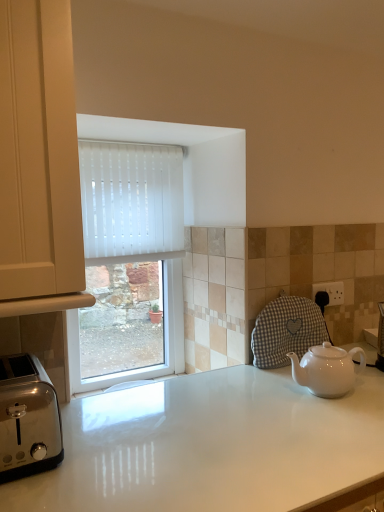
Question: Can you confirm if white glossy countertop at center is smaller than white ceramic teapot at lower right?

Choices:
 (A) no
 (B) yes

Answer: (A)

Question: Is white glossy countertop at center shorter than white ceramic teapot at lower right?

Choices:
 (A) yes
 (B) no

Answer: (B)

Question: Could you tell me if white glossy countertop at center is facing white ceramic teapot at lower right?

Choices:
 (A) yes
 (B) no

Answer: (B)

Question: From a real-world perspective, is white glossy countertop at center under white ceramic teapot at lower right?

Choices:
 (A) yes
 (B) no

Answer: (A)

Question: Is white ceramic teapot at lower right surrounded by white glossy countertop at center?

Choices:
 (A) yes
 (B) no

Answer: (B)

Question: Is polished stainless steel toaster at lower left wider or thinner than white ceramic teapot at lower right?

Choices:
 (A) wide
 (B) thin

Answer: (A)

Question: From the image's perspective, is polished stainless steel toaster at lower left above or below white ceramic teapot at lower right?

Choices:
 (A) above
 (B) below

Answer: (B)

Question: From a real-world perspective, relative to white ceramic teapot at lower right, is polished stainless steel toaster at lower left vertically above or below?

Choices:
 (A) above
 (B) below

Answer: (A)

Question: Based on their sizes in the image, would you say polished stainless steel toaster at lower left is bigger or smaller than white ceramic teapot at lower right?

Choices:
 (A) big
 (B) small

Answer: (A)

Question: Is white glossy countertop at center spatially inside white ceramic teapot at lower right, or outside of it?

Choices:
 (A) outside
 (B) inside

Answer: (A)

Question: Relative to white ceramic teapot at lower right, is white glossy countertop at center in front or behind?

Choices:
 (A) front
 (B) behind

Answer: (A)

Question: Is white glossy countertop at center wider or thinner than white ceramic teapot at lower right?

Choices:
 (A) thin
 (B) wide

Answer: (B)

Question: Visually, is white glossy countertop at center positioned to the left or to the right of white ceramic teapot at lower right?

Choices:
 (A) right
 (B) left

Answer: (B)

Question: Is white ceramic teapot at lower right bigger or smaller than polished stainless steel toaster at lower left?

Choices:
 (A) small
 (B) big

Answer: (A)

Question: Considering the positions of white ceramic teapot at lower right and polished stainless steel toaster at lower left in the image, is white ceramic teapot at lower right taller or shorter than polished stainless steel toaster at lower left?

Choices:
 (A) short
 (B) tall

Answer: (A)